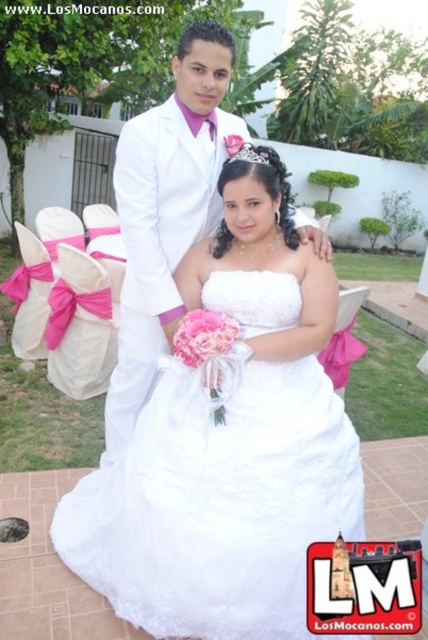
Can you confirm if white satin dress at center is bigger than matte white suit at center?

Actually, white satin dress at center might be smaller than matte white suit at center.

Where is `white satin dress at center`? The width and height of the screenshot is (428, 640). white satin dress at center is located at coordinates (219, 500).